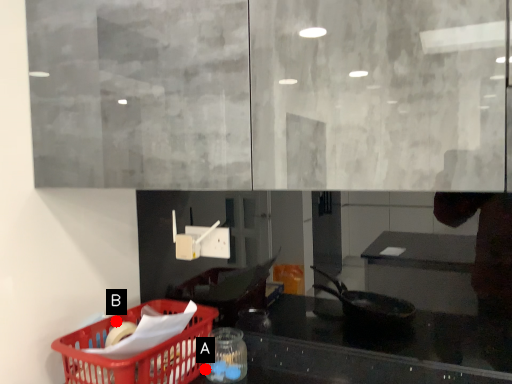
Question: Two points are circled on the image, labeled by A and B beside each circle. Which point is farther from the camera taking this photo?

Choices:
 (A) A is further
 (B) B is further

Answer: (B)